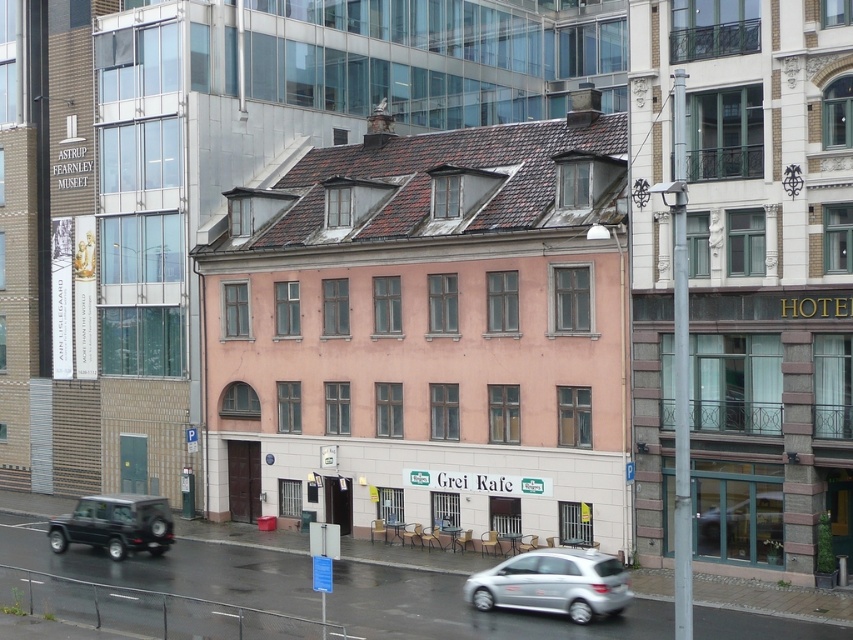
You are a pedestrian standing on the sidewalk and want to cross the street to reach the traditional pink building in the center. There are two vehicles in your path. Which vehicle, the silver metallic hatchback at lower center or the matte black suv at lower left, is closer to you as you stand on the sidewalk?

The silver metallic hatchback at lower center is closer to you because it is positioned over the matte black suv at lower left, meaning it is in front of the suv and nearer to your position on the sidewalk.

You are standing at the intersection near the Astrup Fearnley Museet and want to park your silver metallic hatchback at lower center. The parking spot you want is located at point (553,582). Can you safely park your car there without blocking the entrance of the Grei Rafe restaurant?

The point (553,582) marks the silver metallic hatchback at lower center, so parking there would place your car directly at that location. Since the entrance to Grei Rafe is at the ground floor of the traditional pink building, which is the central focus of the image, parking at that exact point might block the entrance. Please choose a different parking spot to avoid obstructing access.